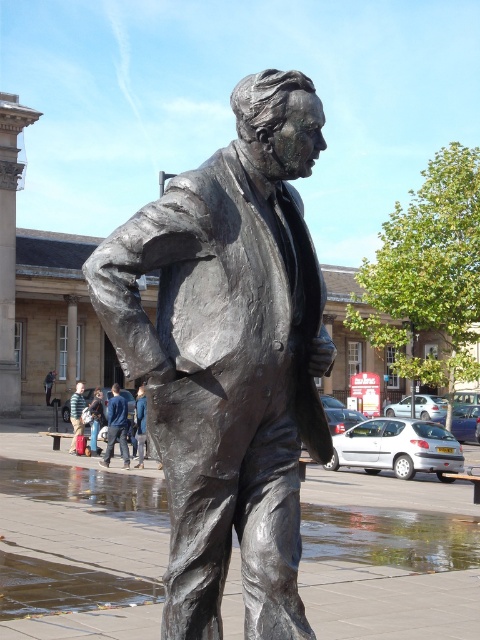
Between bronze statue at center and blue denim jeans at center, which one is positioned lower?

blue denim jeans at center is lower down.

Is bronze statue at center above blue denim jeans at center?

Yes.

Does point (176, 618) come closer to viewer compared to point (113, 438)?

Yes.

The image size is (480, 640). I want to click on bronze statue at center, so click(x=229, y=356).

Between blue denim jeans at center and matte black jacket at center, which one has less height?

Standing shorter between the two is matte black jacket at center.

Measure the distance between blue denim jeans at center and camera.

blue denim jeans at center and camera are 26.41 meters apart.

Where is `blue denim jeans at center`? This screenshot has width=480, height=640. blue denim jeans at center is located at coordinates (117, 426).

Consider the image. Does bronze statue at center have a greater height compared to matte black jacket at center?

Yes.

Is point (265, 141) positioned after point (83, 406)?

That is False.

Where is `bronze statue at center`? The image size is (480, 640). bronze statue at center is located at coordinates (229, 356).